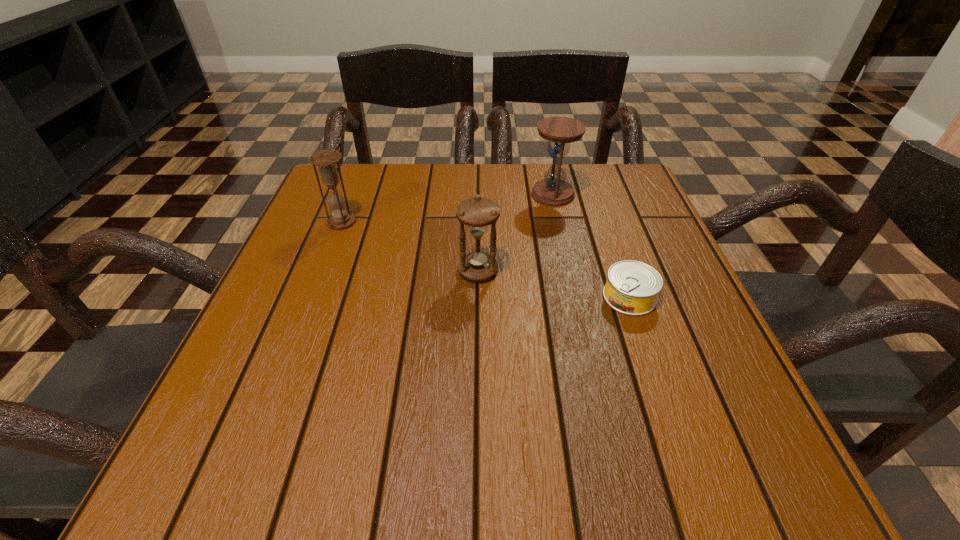
Find the location of a particular element. The width and height of the screenshot is (960, 540). the rightmost hourglass is located at coordinates (553, 190).

Locate an element on the screen. The image size is (960, 540). the farthest object is located at coordinates (553, 190).

At what (x,y) coordinates should I click in order to perform the action: click on the leftmost hourglass. Please return your answer as a coordinate pair (x, y). Looking at the image, I should click on (326, 160).

At what (x,y) coordinates should I click in order to perform the action: click on the second farthest hourglass. Please return your answer as a coordinate pair (x, y). The width and height of the screenshot is (960, 540). Looking at the image, I should click on [326, 160].

I want to click on the second hourglass from right to left, so click(477, 265).

Find the location of a particular element. The width and height of the screenshot is (960, 540). the second object from left to right is located at coordinates (477, 265).

Where is `the shortest object`? The width and height of the screenshot is (960, 540). the shortest object is located at coordinates (632, 287).

Find the location of a particular element. free point located on the front of the rightmost hourglass is located at coordinates click(x=562, y=234).

Identify the location of free space located 0.320m on the front of the leftmost object. (295, 343).

Where is `free space located on the right of the third object from right to left`? The image size is (960, 540). free space located on the right of the third object from right to left is located at coordinates (681, 271).